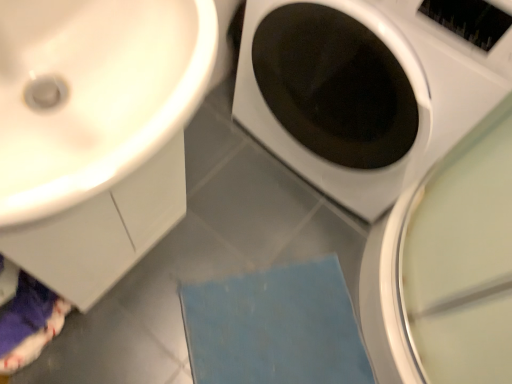
Question: Can you confirm if blue fabric bath mat at lower center is bigger than white glossy washing machine at center?

Choices:
 (A) no
 (B) yes

Answer: (A)

Question: Considering the relative sizes of blue fabric bath mat at lower center and white glossy washing machine at center in the image provided, is blue fabric bath mat at lower center shorter than white glossy washing machine at center?

Choices:
 (A) no
 (B) yes

Answer: (B)

Question: From a real-world perspective, is blue fabric bath mat at lower center physically above white glossy washing machine at center?

Choices:
 (A) yes
 (B) no

Answer: (B)

Question: Is blue fabric bath mat at lower center far away from white glossy washing machine at center?

Choices:
 (A) no
 (B) yes

Answer: (A)

Question: From a real-world perspective, is blue fabric bath mat at lower center positioned under white glossy washing machine at center based on gravity?

Choices:
 (A) yes
 (B) no

Answer: (A)

Question: Is blue fabric bath mat at lower center outside white glossy washing machine at center?

Choices:
 (A) no
 (B) yes

Answer: (B)

Question: Is there a large distance between white glossy sink at upper left and blue fabric bath mat at lower center?

Choices:
 (A) no
 (B) yes

Answer: (A)

Question: Considering the relative sizes of white glossy sink at upper left and blue fabric bath mat at lower center in the image provided, is white glossy sink at upper left bigger than blue fabric bath mat at lower center?

Choices:
 (A) no
 (B) yes

Answer: (B)

Question: Is white glossy sink at upper left beside blue fabric bath mat at lower center?

Choices:
 (A) no
 (B) yes

Answer: (A)

Question: Can you confirm if white glossy sink at upper left is wider than blue fabric bath mat at lower center?

Choices:
 (A) no
 (B) yes

Answer: (A)

Question: From the image's perspective, is white glossy sink at upper left under blue fabric bath mat at lower center?

Choices:
 (A) no
 (B) yes

Answer: (A)

Question: Can you confirm if white glossy sink at upper left is thinner than blue fabric bath mat at lower center?

Choices:
 (A) no
 (B) yes

Answer: (B)

Question: From a real-world perspective, is blue fabric bath mat at lower center beneath white glossy sink at upper left?

Choices:
 (A) yes
 (B) no

Answer: (A)